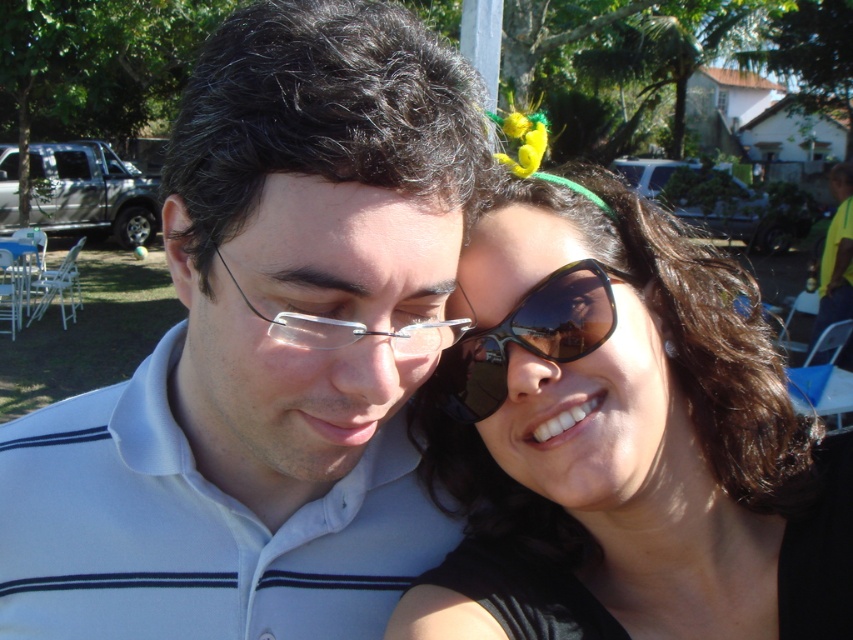
You are a photographer trying to capture a candid shot of the two people in the scene. You want to ensure the white matte shirt at center and the sunglasses at upper right are both in focus. Since the camera can only focus on one subject at a time, which object should you prioritize focusing on to ensure the other is also in focus due to their spatial relationship?

You should focus on the white matte shirt at center because it is positioned to the left of the sunglasses at upper right, meaning they are closer to the camera. This way, the sunglasses at upper right will still be within the depth of field and in focus.

You are a photographer trying to capture a candid shot of the two people in the image. You want to ensure that both the white matte shirt at center and the sunglasses at upper right are clearly visible in the frame. Given their relative sizes in the photo, which object should you focus on first to ensure proper exposure?

The white matte shirt at center is much taller than the sunglasses at upper right, so you should focus on the white matte shirt at center first to ensure proper exposure since it occupies a larger area in the frame.